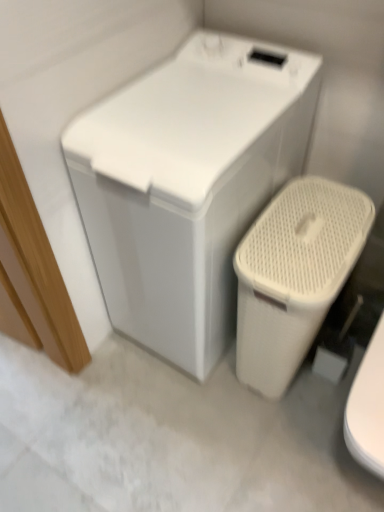
Measure the distance between white matte washing machine at upper center and camera.

A distance of 33.50 inches exists between white matte washing machine at upper center and camera.

At what (x,y) coordinates should I click in order to perform the action: click on white matte washing machine at upper center. Please return your answer as a coordinate pair (x, y). Looking at the image, I should click on (188, 185).

Image resolution: width=384 pixels, height=512 pixels. Describe the element at coordinates (188, 185) in the screenshot. I see `white matte washing machine at upper center` at that location.

Describe the element at coordinates (294, 275) in the screenshot. I see `beige textured plastic toilet at lower right` at that location.

This screenshot has height=512, width=384. I want to click on beige textured plastic toilet at lower right, so click(x=294, y=275).

The height and width of the screenshot is (512, 384). In order to click on white matte washing machine at upper center in this screenshot , I will do `click(188, 185)`.

Is beige textured plastic toilet at lower right to the right of white matte washing machine at upper center from the viewer's perspective?

Correct, you'll find beige textured plastic toilet at lower right to the right of white matte washing machine at upper center.

In the image, is beige textured plastic toilet at lower right positioned in front of or behind white matte washing machine at upper center?

beige textured plastic toilet at lower right is positioned farther from the viewer than white matte washing machine at upper center.

Considering the positions of point (263, 227) and point (145, 250), is point (263, 227) closer or farther from the camera than point (145, 250)?

Point (263, 227).

From the image's perspective, is beige textured plastic toilet at lower right located above or below white matte washing machine at upper center?

beige textured plastic toilet at lower right is below white matte washing machine at upper center.

From a real-world perspective, is beige textured plastic toilet at lower right above or below white matte washing machine at upper center?

In terms of real-world spatial position, beige textured plastic toilet at lower right is below white matte washing machine at upper center.

Can you confirm if beige textured plastic toilet at lower right is wider than white matte washing machine at upper center?

In fact, beige textured plastic toilet at lower right might be narrower than white matte washing machine at upper center.

In terms of height, does beige textured plastic toilet at lower right look taller or shorter compared to white matte washing machine at upper center?

beige textured plastic toilet at lower right is shorter than white matte washing machine at upper center.

From the picture: Can you confirm if beige textured plastic toilet at lower right is smaller than white matte washing machine at upper center?

Yes, beige textured plastic toilet at lower right is smaller than white matte washing machine at upper center.

Is beige textured plastic toilet at lower right surrounding white matte washing machine at upper center?

That's incorrect, white matte washing machine at upper center is not inside beige textured plastic toilet at lower right.

Is beige textured plastic toilet at lower right not near white matte washing machine at upper center?

No, there isn't a large distance between beige textured plastic toilet at lower right and white matte washing machine at upper center.

Is beige textured plastic toilet at lower right aimed at white matte washing machine at upper center?

No, beige textured plastic toilet at lower right is not facing towards white matte washing machine at upper center.

Could you measure the distance between beige textured plastic toilet at lower right and white matte washing machine at upper center?

The distance of beige textured plastic toilet at lower right from white matte washing machine at upper center is 8.66 inches.

In order to click on washing machine on the left of beige textured plastic toilet at lower right in this screenshot , I will do `click(188, 185)`.

Which is more to the right, white matte washing machine at upper center or beige textured plastic toilet at lower right?

From the viewer's perspective, beige textured plastic toilet at lower right appears more on the right side.

Is white matte washing machine at upper center in front of or behind beige textured plastic toilet at lower right in the image?

white matte washing machine at upper center is positioned closer to the viewer than beige textured plastic toilet at lower right.

Is point (152, 194) positioned behind point (284, 204)?

No, it is not.

From the image's perspective, is white matte washing machine at upper center above or below beige textured plastic toilet at lower right?

From the image's perspective, white matte washing machine at upper center appears above beige textured plastic toilet at lower right.

From a real-world perspective, is white matte washing machine at upper center positioned over beige textured plastic toilet at lower right based on gravity?

Yes, from a real-world perspective, white matte washing machine at upper center is on top of beige textured plastic toilet at lower right.

Looking at their sizes, would you say white matte washing machine at upper center is wider or thinner than beige textured plastic toilet at lower right?

Considering their sizes, white matte washing machine at upper center looks broader than beige textured plastic toilet at lower right.

Does white matte washing machine at upper center have a greater height compared to beige textured plastic toilet at lower right?

Indeed, white matte washing machine at upper center has a greater height compared to beige textured plastic toilet at lower right.

Considering the relative sizes of white matte washing machine at upper center and beige textured plastic toilet at lower right in the image provided, is white matte washing machine at upper center bigger than beige textured plastic toilet at lower right?

Yes.

Would you say white matte washing machine at upper center contains beige textured plastic toilet at lower right?

No, white matte washing machine at upper center does not contain beige textured plastic toilet at lower right.

Is white matte washing machine at upper center in contact with beige textured plastic toilet at lower right?

No, white matte washing machine at upper center is not with beige textured plastic toilet at lower right.

Is white matte washing machine at upper center looking in the opposite direction of beige textured plastic toilet at lower right?

No.

What's the angular difference between white matte washing machine at upper center and beige textured plastic toilet at lower right's facing directions?

white matte washing machine at upper center and beige textured plastic toilet at lower right are facing 0.101 degrees away from each other.

Measure the distance from white matte washing machine at upper center to beige textured plastic toilet at lower right.

The distance of white matte washing machine at upper center from beige textured plastic toilet at lower right is 8.66 inches.

Find the location of a particular element. toilet to the right of white matte washing machine at upper center is located at coordinates (294, 275).

This screenshot has height=512, width=384. In order to click on toilet that appears below the white matte washing machine at upper center (from the image's perspective) in this screenshot , I will do `click(294, 275)`.

Identify the location of toilet below the white matte washing machine at upper center (from a real-world perspective). (294, 275).